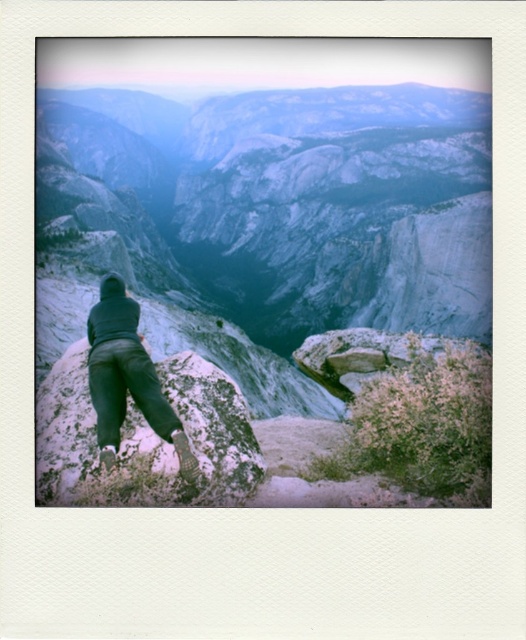
Identify the location of smooth granite rock at center. The height and width of the screenshot is (640, 526). (282, 204).

Does smooth granite rock at center have a greater height compared to dark gray pants at center?

Yes.

The image size is (526, 640). In order to click on smooth granite rock at center in this screenshot , I will do `click(282, 204)`.

Who is lower down, white textured rock at center or dark gray pants at center?

Positioned lower is white textured rock at center.

Can you confirm if white textured rock at center is taller than dark gray pants at center?

Incorrect, white textured rock at center's height is not larger of dark gray pants at center's.

What do you see at coordinates (146, 440) in the screenshot? I see `white textured rock at center` at bounding box center [146, 440].

Identify the location of white textured rock at center. Image resolution: width=526 pixels, height=640 pixels. (146, 440).

Who is positioned more to the right, smooth granite rock at center or white textured rock at center?

Positioned to the right is smooth granite rock at center.

Can you confirm if smooth granite rock at center is taller than white textured rock at center?

Correct, smooth granite rock at center is much taller as white textured rock at center.

Who is more distant from viewer, (183,237) or (209,445)?

The point (183,237) is behind.

This screenshot has height=640, width=526. What are the coordinates of `smooth granite rock at center` in the screenshot? It's located at (282, 204).